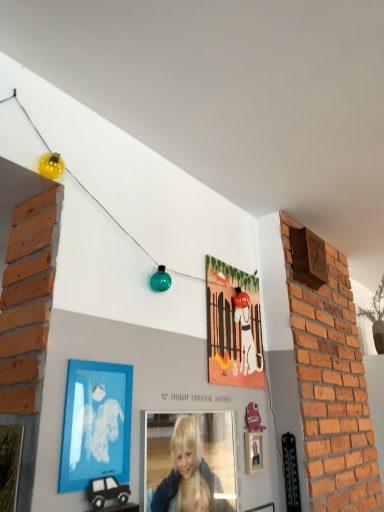
Describe the element at coordinates (96, 424) in the screenshot. I see `blue matte picture frame at lower left, the 3th picture frame positioned from the back` at that location.

Describe the element at coordinates (233, 326) in the screenshot. I see `matte paper picture frame at center, which is counted as the 4th picture frame, starting from the front` at that location.

Describe the element at coordinates (190, 463) in the screenshot. This screenshot has width=384, height=512. I see `smooth blonde hair at center` at that location.

How much space does wooden picture frame at lower left, marked as the fourth picture frame in a back-to-front arrangement, occupy vertically?

wooden picture frame at lower left, marked as the fourth picture frame in a back-to-front arrangement, is 18.14 inches in height.

At what (x,y) coordinates should I click in order to perform the action: click on wooden picture frame at lower center, which is the third picture frame in front-to-back order. Please return your answer as a coordinate pair (x, y). This screenshot has height=512, width=384. Looking at the image, I should click on (263, 508).

Locate an element on the screen. The height and width of the screenshot is (512, 384). blue matte picture frame at lower left, which appears as the second picture frame when viewed from the left is located at coordinates (96, 424).

From the image's perspective, is matte paper picture frame at center, which is counted as the 4th picture frame, starting from the front, located above or below blue matte picture frame at lower left, the 3th picture frame positioned from the back?

matte paper picture frame at center, which is counted as the 4th picture frame, starting from the front, is situated higher than blue matte picture frame at lower left, the 3th picture frame positioned from the back, in the image.

How different are the orientations of matte paper picture frame at center, the second picture frame when ordered from right to left, and blue matte picture frame at lower left, the 3th picture frame positioned from the back, in degrees?

There is a 0.1-degree angle between the facing directions of matte paper picture frame at center, the second picture frame when ordered from right to left, and blue matte picture frame at lower left, the 3th picture frame positioned from the back.

This screenshot has width=384, height=512. In order to click on the 2nd picture frame in front of the matte paper picture frame at center, which is counted as the 4th picture frame, starting from the front in this screenshot , I will do `click(96, 424)`.

Is matte paper picture frame at center, arranged as the 3th picture frame when viewed from the left, wider or thinner than blue matte picture frame at lower left, which is the 3th picture frame in right-to-left order?

Clearly, matte paper picture frame at center, arranged as the 3th picture frame when viewed from the left, has more width compared to blue matte picture frame at lower left, which is the 3th picture frame in right-to-left order.

From the image's perspective, is blue matte picture frame at lower left, which is the 3th picture frame in right-to-left order, located above wooden picture frame at lower left, placed as the 4th picture frame when sorted from right to left?

Yes, from the image's perspective, blue matte picture frame at lower left, which is the 3th picture frame in right-to-left order, is on top of wooden picture frame at lower left, placed as the 4th picture frame when sorted from right to left.

Are blue matte picture frame at lower left, which is the 3th picture frame in right-to-left order, and wooden picture frame at lower left, which appears as the first picture frame when viewed from the left, far apart?

That's not correct — blue matte picture frame at lower left, which is the 3th picture frame in right-to-left order, is a little close to wooden picture frame at lower left, which appears as the first picture frame when viewed from the left.

Considering the positions of objects blue matte picture frame at lower left, which appears as the second picture frame when viewed from the left, and wooden picture frame at lower left, marked as the fourth picture frame in a back-to-front arrangement, in the image provided, who is more to the right, blue matte picture frame at lower left, which appears as the second picture frame when viewed from the left, or wooden picture frame at lower left, marked as the fourth picture frame in a back-to-front arrangement,?

blue matte picture frame at lower left, which appears as the second picture frame when viewed from the left, is more to the right.

Which of these two, blue matte picture frame at lower left, acting as the second picture frame starting from the front, or wooden picture frame at lower left, placed as the 4th picture frame when sorted from right to left, stands taller?

With more height is wooden picture frame at lower left, placed as the 4th picture frame when sorted from right to left.

Can you confirm if blue matte picture frame at lower left, the 3th picture frame positioned from the back, is positioned to the right of wooden picture frame at lower center, which is the third picture frame in front-to-back order?

Incorrect, blue matte picture frame at lower left, the 3th picture frame positioned from the back, is not on the right side of wooden picture frame at lower center, which is the third picture frame in front-to-back order.

Find the location of a particular element. the 1st picture frame behind the blue matte picture frame at lower left, which is the 3th picture frame in right-to-left order is located at coordinates (263, 508).

Could you tell me if blue matte picture frame at lower left, acting as the second picture frame starting from the front, is facing wooden picture frame at lower center, the fourth picture frame from the left?

No, blue matte picture frame at lower left, acting as the second picture frame starting from the front, is not aimed at wooden picture frame at lower center, the fourth picture frame from the left.

How far apart are smooth blonde hair at center and matte paper picture frame at center, which appears as the first picture frame when viewed from the back?

They are 14.45 inches apart.

Considering the positions of point (218, 467) and point (258, 356), is point (218, 467) closer or farther from the camera than point (258, 356)?

Point (218, 467) is positioned closer to the camera compared to point (258, 356).

From the image's perspective, which one is positioned lower, smooth blonde hair at center or matte paper picture frame at center, which is counted as the 4th picture frame, starting from the front?

smooth blonde hair at center is shown below in the image.

Who is smaller, smooth blonde hair at center or matte paper picture frame at center, arranged as the 3th picture frame when viewed from the left?

matte paper picture frame at center, arranged as the 3th picture frame when viewed from the left.

In the scene shown: From a real-world perspective, which is physically above, wooden picture frame at lower center, the fourth picture frame from the left, or blue matte picture frame at lower left, the 3th picture frame positioned from the back?

From a 3D spatial view, blue matte picture frame at lower left, the 3th picture frame positioned from the back, is above.

Is wooden picture frame at lower center, which is the third picture frame in front-to-back order, situated inside blue matte picture frame at lower left, acting as the second picture frame starting from the front, or outside?

wooden picture frame at lower center, which is the third picture frame in front-to-back order, is outside blue matte picture frame at lower left, acting as the second picture frame starting from the front.

From the image's perspective, is wooden picture frame at lower center, which is the third picture frame in front-to-back order, located beneath blue matte picture frame at lower left, acting as the second picture frame starting from the front?

Yes, from the image's perspective, wooden picture frame at lower center, which is the third picture frame in front-to-back order, is beneath blue matte picture frame at lower left, acting as the second picture frame starting from the front.

Considering the sizes of wooden picture frame at lower center, which is the first picture frame from right to left, and blue matte picture frame at lower left, the 3th picture frame positioned from the back, in the image, is wooden picture frame at lower center, which is the first picture frame from right to left, wider or thinner than blue matte picture frame at lower left, the 3th picture frame positioned from the back,?

wooden picture frame at lower center, which is the first picture frame from right to left, is wider than blue matte picture frame at lower left, the 3th picture frame positioned from the back.

Would you say wooden picture frame at lower center, which is the 2th picture frame from back to front, is outside matte paper picture frame at center, the second picture frame when ordered from right to left?

wooden picture frame at lower center, which is the 2th picture frame from back to front, is positioned outside matte paper picture frame at center, the second picture frame when ordered from right to left.

Does wooden picture frame at lower center, which is the 2th picture frame from back to front, have a greater height compared to matte paper picture frame at center, which appears as the first picture frame when viewed from the back?

No, wooden picture frame at lower center, which is the 2th picture frame from back to front, is not taller than matte paper picture frame at center, which appears as the first picture frame when viewed from the back.

Which is less distant, (255, 509) or (259, 377)?

Point (255, 509) is positioned closer to the camera compared to point (259, 377).

Is smooth blonde hair at center positioned in front of blue matte picture frame at lower left, the 3th picture frame positioned from the back?

No, smooth blonde hair at center is further to the viewer.

Does point (195, 509) come behind point (84, 463)?

Yes, it is.

From a real-world perspective, between smooth blonde hair at center and blue matte picture frame at lower left, which is the 3th picture frame in right-to-left order, who is vertically lower?

smooth blonde hair at center.

At what (x,y) coordinates should I click in order to perform the action: click on picture frame that is above the blue matte picture frame at lower left, acting as the second picture frame starting from the front (from a real-world perspective). Please return your answer as a coordinate pair (x, y). This screenshot has height=512, width=384. Looking at the image, I should click on (233, 326).

I want to click on picture frame that is the 1st object to the right of the wooden picture frame at lower left, the 1th picture frame in the front-to-back sequence, starting at the anchor, so click(96, 424).

From the image, which object appears to be nearer to wooden picture frame at lower left, marked as the fourth picture frame in a back-to-front arrangement, smooth blonde hair at center or blue matte picture frame at lower left, acting as the second picture frame starting from the front?

The object closer to wooden picture frame at lower left, marked as the fourth picture frame in a back-to-front arrangement, is blue matte picture frame at lower left, acting as the second picture frame starting from the front.

From the image, which object appears to be farther from smooth blonde hair at center, wooden picture frame at lower left, marked as the fourth picture frame in a back-to-front arrangement, or matte paper picture frame at center, arranged as the 3th picture frame when viewed from the left?

Among the two, wooden picture frame at lower left, marked as the fourth picture frame in a back-to-front arrangement, is located further to smooth blonde hair at center.

Considering their positions, is wooden picture frame at lower left, placed as the 4th picture frame when sorted from right to left, positioned closer to blue matte picture frame at lower left, which appears as the second picture frame when viewed from the left, than matte paper picture frame at center, arranged as the 3th picture frame when viewed from the left?

The object closer to blue matte picture frame at lower left, which appears as the second picture frame when viewed from the left, is wooden picture frame at lower left, placed as the 4th picture frame when sorted from right to left.

Which object lies nearer to the anchor point wooden picture frame at lower left, the 1th picture frame in the front-to-back sequence, blue matte picture frame at lower left, acting as the second picture frame starting from the front, or smooth blonde hair at center?

Among the two, blue matte picture frame at lower left, acting as the second picture frame starting from the front, is located nearer to wooden picture frame at lower left, the 1th picture frame in the front-to-back sequence.

Looking at the image, which one is located closer to wooden picture frame at lower center, which is the 2th picture frame from back to front, wooden picture frame at lower left, marked as the fourth picture frame in a back-to-front arrangement, or smooth blonde hair at center?

Based on the image, smooth blonde hair at center appears to be nearer to wooden picture frame at lower center, which is the 2th picture frame from back to front.

Considering their positions, is smooth blonde hair at center positioned closer to blue matte picture frame at lower left, which appears as the second picture frame when viewed from the left, than wooden picture frame at lower center, which is the first picture frame from right to left?

Based on the image, smooth blonde hair at center appears to be nearer to blue matte picture frame at lower left, which appears as the second picture frame when viewed from the left.

Looking at the image, which one is located closer to blue matte picture frame at lower left, which appears as the second picture frame when viewed from the left, matte paper picture frame at center, which appears as the first picture frame when viewed from the back, or smooth blonde hair at center?

Based on the image, smooth blonde hair at center appears to be nearer to blue matte picture frame at lower left, which appears as the second picture frame when viewed from the left.

Considering their positions, is blue matte picture frame at lower left, which is the 3th picture frame in right-to-left order, positioned further to smooth blonde hair at center than wooden picture frame at lower left, placed as the 4th picture frame when sorted from right to left?

wooden picture frame at lower left, placed as the 4th picture frame when sorted from right to left, is further to smooth blonde hair at center.

Locate an element on the screen. This screenshot has height=512, width=384. person between blue matte picture frame at lower left, acting as the second picture frame starting from the front, and matte paper picture frame at center, arranged as the 3th picture frame when viewed from the left, in the front-back direction is located at coordinates (190, 463).

Locate an element on the screen. Image resolution: width=384 pixels, height=512 pixels. person located between wooden picture frame at lower left, marked as the fourth picture frame in a back-to-front arrangement, and matte paper picture frame at center, which appears as the first picture frame when viewed from the back, in the left-right direction is located at coordinates (190, 463).

Where is `person between blue matte picture frame at lower left, which appears as the second picture frame when viewed from the left, and wooden picture frame at lower center, which is the third picture frame in front-to-back order, vertically`? The width and height of the screenshot is (384, 512). person between blue matte picture frame at lower left, which appears as the second picture frame when viewed from the left, and wooden picture frame at lower center, which is the third picture frame in front-to-back order, vertically is located at coordinates (190, 463).

Locate an element on the screen. This screenshot has height=512, width=384. person between matte paper picture frame at center, arranged as the 3th picture frame when viewed from the left, and wooden picture frame at lower center, the fourth picture frame from the left, in the up-down direction is located at coordinates (190, 463).